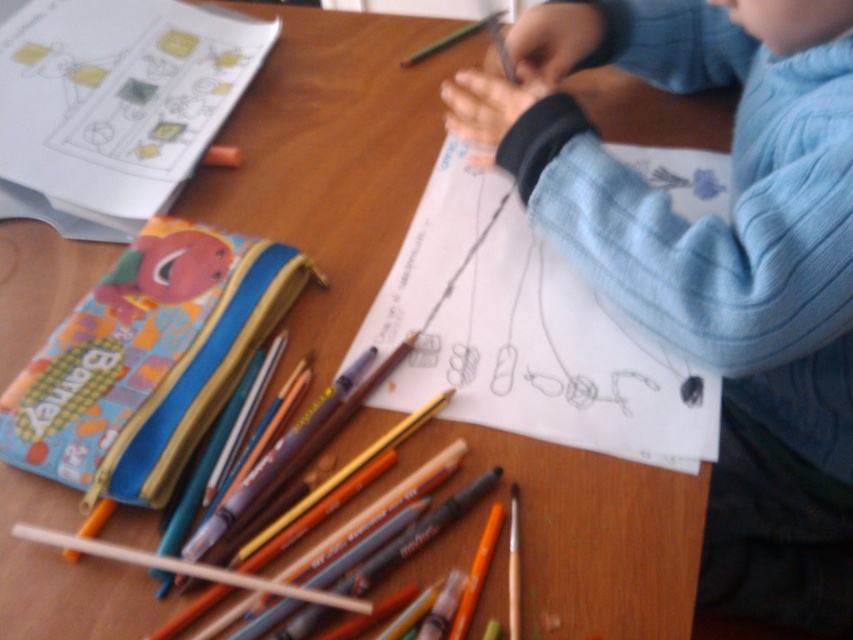
Question: Which point is farther from the camera taking this photo?

Choices:
 (A) (482, 259)
 (B) (97, 520)

Answer: (A)

Question: Does white paper at upper left have a larger size compared to matte orange crayon at lower left?

Choices:
 (A) no
 (B) yes

Answer: (B)

Question: Does white paper at center appear under matte orange crayon at lower left?

Choices:
 (A) no
 (B) yes

Answer: (A)

Question: Estimate the real-world distances between objects in this image. Which object is farther from the white paper at center?

Choices:
 (A) matte orange crayon at lower left
 (B) blue corduroy sweater at upper right

Answer: (A)

Question: Among these points, which one is nearest to the camera?

Choices:
 (A) (155, 52)
 (B) (585, 417)

Answer: (B)

Question: Does white paper at center appear on the left side of white paper at upper left?

Choices:
 (A) no
 (B) yes

Answer: (A)